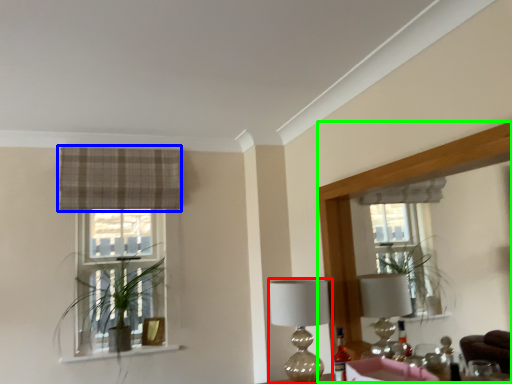
Question: Which is farther away from table lamp (highlighted by a red box)? curtain (highlighted by a blue box) or mirror (highlighted by a green box)?

Choices:
 (A) curtain
 (B) mirror

Answer: (A)